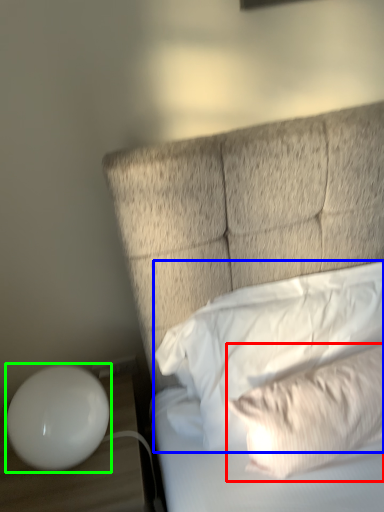
Question: Based on their relative distances, which object is nearer to pillow (highlighted by a red box)? Choose from pillow (highlighted by a blue box) and table lamp (highlighted by a green box).

Choices:
 (A) pillow
 (B) table lamp

Answer: (A)